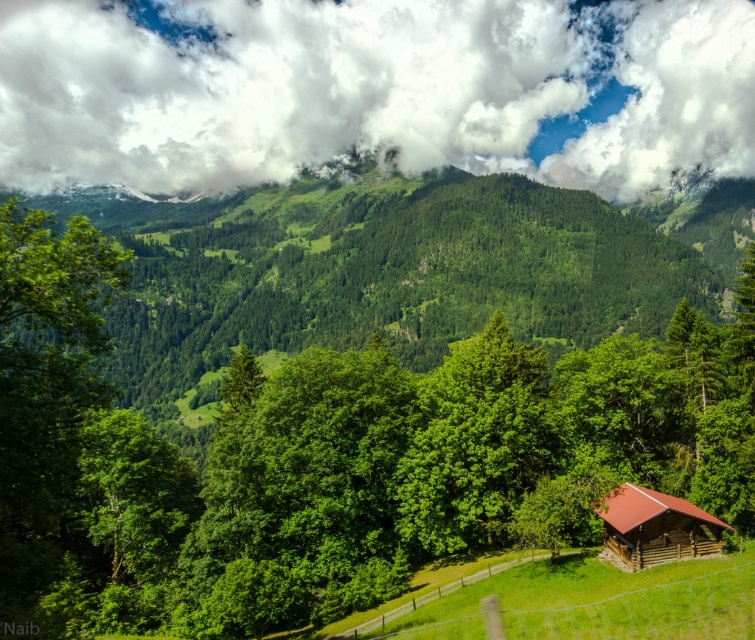
How much distance is there between green leafy tree at center and white fluffy cloud at upper center?

The distance of green leafy tree at center from white fluffy cloud at upper center is 209.19 meters.

Is point (606, 477) closer to viewer compared to point (350, 42)?

Yes, it is.

Describe the element at coordinates (344, 396) in the screenshot. I see `green leafy tree at center` at that location.

The height and width of the screenshot is (640, 755). I want to click on green leafy tree at center, so click(344, 396).

Can you confirm if green leafy tree at center is wider than brown wooden cabin at center-right?

Correct, the width of green leafy tree at center exceeds that of brown wooden cabin at center-right.

Does green leafy tree at center have a lesser height compared to brown wooden cabin at center-right?

Incorrect, green leafy tree at center's height does not fall short of brown wooden cabin at center-right's.

Which is behind, point (88, 390) or point (621, 564)?

Point (621, 564)

At what (x,y) coordinates should I click in order to perform the action: click on green leafy tree at center. Please return your answer as a coordinate pair (x, y). The image size is (755, 640). Looking at the image, I should click on (344, 396).

Does white fluffy cloud at upper center have a greater height compared to brown wooden cabin at center-right?

Yes.

The height and width of the screenshot is (640, 755). What do you see at coordinates (371, 90) in the screenshot?
I see `white fluffy cloud at upper center` at bounding box center [371, 90].

From the picture: Who is more forward, (x=501, y=113) or (x=700, y=538)?

Point (x=700, y=538) is in front.

You are a GUI agent. You are given a task and a screenshot of the screen. Output one action in this format:
    pyautogui.click(x=<x>, y=<y>)
    Task: Click on the white fluffy cloud at upper center
    
    Given the screenshot: What is the action you would take?
    pyautogui.click(x=371, y=90)